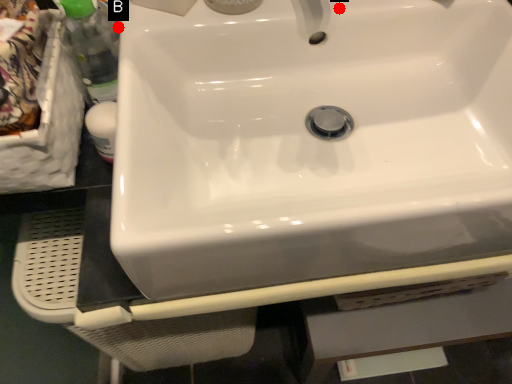
Question: Two points are circled on the image, labeled by A and B beside each circle. Which point appears farthest from the camera in this image?

Choices:
 (A) A is further
 (B) B is further

Answer: (B)